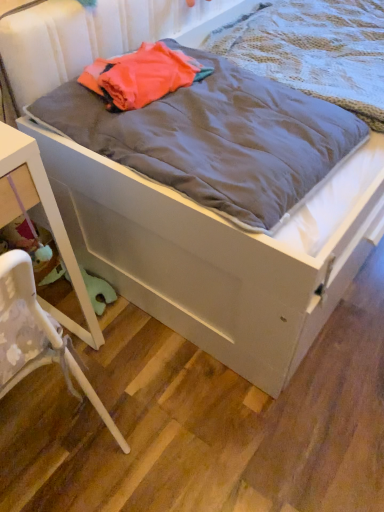
Where is `free area in between white glossy nightstand at lower left and white plastic chair at lower left`? This screenshot has height=512, width=384. free area in between white glossy nightstand at lower left and white plastic chair at lower left is located at coordinates (114, 394).